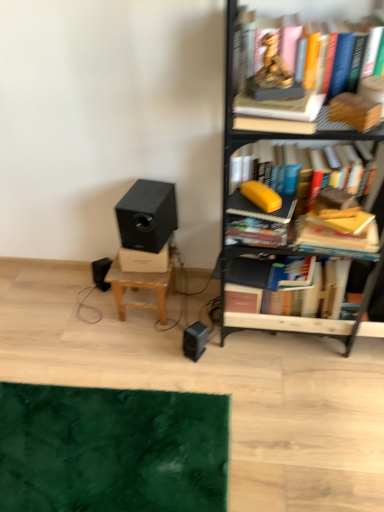
Based on the photo, measure the distance between point (196,339) and camera.

Point (196,339) and camera are 5.51 feet apart.

Identify the location of black matte speaker at center-left. (147, 215).

Locate an element on the screen. This screenshot has width=384, height=512. gold statue at upper center, placed as the 4th book when sorted from bottom to top is located at coordinates (274, 116).

The width and height of the screenshot is (384, 512). Describe the element at coordinates (258, 222) in the screenshot. I see `matte yellow book at center, positioned as the 3th book in top-to-bottom order` at that location.

In order to face wooden stool at lower center, should I rotate leftwards or rightwards?

Rotate your view left by about 5.681°.

This screenshot has height=512, width=384. What do you see at coordinates (141, 288) in the screenshot?
I see `wooden stool at lower center` at bounding box center [141, 288].

This screenshot has width=384, height=512. Identify the location of black plastic speaker at lower center. (195, 340).

Visually, is hardcover book at center right, which is counted as the fourth book, starting from the top, positioned to the left or to the right of black matte speaker at center-left?

Based on their positions, hardcover book at center right, which is counted as the fourth book, starting from the top, is located to the right of black matte speaker at center-left.

Which object is further away from the camera taking this photo, hardcover book at center right, which is counted as the fourth book, starting from the top, or black matte speaker at center-left?

Positioned behind is black matte speaker at center-left.

Is point (252, 282) positioned behind point (130, 215)?

No, it is in front of (130, 215).

Does hardcover book at center right, the 1th book ordered from the bottom, have a greater height compared to black matte speaker at center-left?

Indeed, hardcover book at center right, the 1th book ordered from the bottom, has a greater height compared to black matte speaker at center-left.

Is yellow matte book at center-right, which is the 1th paperback book in bottom-to-top order, at the left side of wooden stool at lower center?

In fact, yellow matte book at center-right, which is the 1th paperback book in bottom-to-top order, is to the right of wooden stool at lower center.

Is yellow matte book at center-right, placed as the 3th paperback book when sorted from top to bottom, outside of wooden stool at lower center?

Yes, yellow matte book at center-right, placed as the 3th paperback book when sorted from top to bottom, is located beyond the bounds of wooden stool at lower center.

Does yellow matte book at center-right, which is the 1th paperback book in bottom-to-top order, have a lesser height compared to wooden stool at lower center?

Yes, yellow matte book at center-right, which is the 1th paperback book in bottom-to-top order, is shorter than wooden stool at lower center.

Considering the sizes of objects metallic black bookcase at right and gold statue at upper center, placed as the 4th book when sorted from bottom to top, in the image provided, who is smaller, metallic black bookcase at right or gold statue at upper center, placed as the 4th book when sorted from bottom to top,?

With smaller size is gold statue at upper center, placed as the 4th book when sorted from bottom to top.

From a real-world perspective, starting from the metallic black bookcase at right, which book is the 2nd one vertically above it? Please provide its 2D coordinates.

[(274, 116)]

From a real-world perspective, is metallic black bookcase at right above or below gold statue at upper center, placed as the 4th book when sorted from bottom to top?

From a real-world perspective, metallic black bookcase at right is physically below gold statue at upper center, placed as the 4th book when sorted from bottom to top.

Considering the positions of objects matte yellow book at center, the second book ordered from the bottom, and black matte speaker at center-left in the image provided, who is behind, matte yellow book at center, the second book ordered from the bottom, or black matte speaker at center-left?

black matte speaker at center-left is behind.

Is matte yellow book at center, the second book ordered from the bottom, taller or shorter than black matte speaker at center-left?

In the image, matte yellow book at center, the second book ordered from the bottom, appears to be shorter than black matte speaker at center-left.

From the image's perspective, count 1st books downward from the black matte speaker at center-left and point to it. Please provide its 2D coordinates.

[(258, 222)]

Is matte yellow book at center, the second book ordered from the bottom, turned away from black matte speaker at center-left?

matte yellow book at center, the second book ordered from the bottom, is not turned away from black matte speaker at center-left.

In terms of width, does wooden book at upper right, which is the second paperback book from bottom to top, look wider or thinner when compared to black plastic speaker at lower center?

Clearly, wooden book at upper right, which is the second paperback book from bottom to top, has less width compared to black plastic speaker at lower center.

From a real-world perspective, is wooden book at upper right, which is the second paperback book from top to bottom, positioned above or below black plastic speaker at lower center?

wooden book at upper right, which is the second paperback book from top to bottom, is above black plastic speaker at lower center.

Is wooden book at upper right, which is the second paperback book from bottom to top, behind black plastic speaker at lower center?

That is False.

Is wooden book at upper right, which is the second paperback book from top to bottom, oriented away from black plastic speaker at lower center?

wooden book at upper right, which is the second paperback book from top to bottom, does not have its back to black plastic speaker at lower center.

From a real-world perspective, is metallic black bookcase at right beneath black matte speaker at center-left?

No.

Considering the sizes of objects metallic black bookcase at right and black matte speaker at center-left in the image provided, who is thinner, metallic black bookcase at right or black matte speaker at center-left?

black matte speaker at center-left is thinner.

Is metallic black bookcase at right taller or shorter than black matte speaker at center-left?

In the image, metallic black bookcase at right appears to be taller than black matte speaker at center-left.

In the image, there is a metallic black bookcase at right. Identify the location of loudspeaker below it (from the image's perspective). Image resolution: width=384 pixels, height=512 pixels. (147, 215).

Who is more distant, wooden book at upper right, which is the second paperback book from top to bottom, or metallic black bookcase at right?

Positioned behind is wooden book at upper right, which is the second paperback book from top to bottom.

Is metallic black bookcase at right at the back of wooden book at upper right, which is the second paperback book from bottom to top?

Yes, wooden book at upper right, which is the second paperback book from bottom to top,'s orientation is away from metallic black bookcase at right.

Do you think wooden book at upper right, which is the second paperback book from bottom to top, is within metallic black bookcase at right, or outside of it?

wooden book at upper right, which is the second paperback book from bottom to top, is spatially positioned inside metallic black bookcase at right.

From the image's perspective, is wooden book at upper right, which is the second paperback book from top to bottom, on top of metallic black bookcase at right?

Indeed, from the image's perspective, wooden book at upper right, which is the second paperback book from top to bottom, is shown above metallic black bookcase at right.

From the black matte speaker at center-left, count 1st books forward and point to it. Please provide its 2D coordinates.

[(266, 291)]

Find the location of a particular element. The height and width of the screenshot is (512, 384). stool that is below the yellow matte book at center-right, placed as the 3th paperback book when sorted from top to bottom (from the image's perspective) is located at coordinates (141, 288).

Based on their spatial positions, is black plastic speaker at lower center or wooden stool at lower center closer to gold metallic statue at upper center, the 3th paperback book from the bottom?

Among the two, wooden stool at lower center is located nearer to gold metallic statue at upper center, the 3th paperback book from the bottom.

Estimate the real-world distances between objects in this image. Which object is further from matte yellow book at center, positioned as the 3th book in top-to-bottom order, metallic black bookcase at right or gold statue at upper center, marked as the 1th book in a top-to-bottom arrangement?

Among the two, gold statue at upper center, marked as the 1th book in a top-to-bottom arrangement, is located further to matte yellow book at center, positioned as the 3th book in top-to-bottom order.

Looking at the image, which one is located closer to metallic black bookcase at right, matte yellow book at center, positioned as the 3th book in top-to-bottom order, or yellow matte pencil case at upper right, which appears as the 2th book when viewed from the top?

matte yellow book at center, positioned as the 3th book in top-to-bottom order, lies closer to metallic black bookcase at right than the other object.

Which object lies nearer to the anchor point matte yellow book at center, the second book ordered from the bottom, black plastic speaker at lower center or metallic black bookcase at right?

metallic black bookcase at right is closer to matte yellow book at center, the second book ordered from the bottom.

Estimate the real-world distances between objects in this image. Which object is closer to metallic black bookcase at right, yellow matte pencil case at upper right, which appears as the 2th book when viewed from the top, or yellow matte book at center-right, which is the 1th paperback book in bottom-to-top order?

yellow matte pencil case at upper right, which appears as the 2th book when viewed from the top, is positioned closer to the anchor metallic black bookcase at right.

When comparing their distances from wooden stool at lower center, does gold metallic statue at upper center, the 3th paperback book from the bottom, or black plastic speaker at lower center seem further?

The object further to wooden stool at lower center is gold metallic statue at upper center, the 3th paperback book from the bottom.

From the picture: When comparing their distances from metallic black bookcase at right, does wooden stool at lower center or hardcover book at center right, the 1th book ordered from the bottom, seem further?

Based on the image, wooden stool at lower center appears to be further to metallic black bookcase at right.

Based on the photo, from the image, which object appears to be nearer to gold metallic statue at upper center, the 1th paperback book when ordered from top to bottom, wooden stool at lower center or yellow matte pencil case at upper right, which appears as the 2th book when viewed from the top?

yellow matte pencil case at upper right, which appears as the 2th book when viewed from the top, is positioned closer to the anchor gold metallic statue at upper center, the 1th paperback book when ordered from top to bottom.

I want to click on loudspeaker between wooden stool at lower center and hardcover book at center right, which is counted as the fourth book, starting from the top, from left to right, so click(x=147, y=215).

Where is `book that lies between gold statue at upper center, placed as the 4th book when sorted from bottom to top, and yellow matte book at center-right, which is the 1th paperback book in bottom-to-top order, from top to bottom`? book that lies between gold statue at upper center, placed as the 4th book when sorted from bottom to top, and yellow matte book at center-right, which is the 1th paperback book in bottom-to-top order, from top to bottom is located at coordinates (333, 240).

What are the coordinates of `loudspeaker between gold statue at upper center, placed as the 4th book when sorted from bottom to top, and wooden stool at lower center, in the vertical direction` in the screenshot? It's located at coord(147,215).

Where is `loudspeaker located between wooden stool at lower center and yellow matte pencil case at upper right, which appears as the 2th book when viewed from the top, in the left-right direction`? loudspeaker located between wooden stool at lower center and yellow matte pencil case at upper right, which appears as the 2th book when viewed from the top, in the left-right direction is located at coordinates (147, 215).